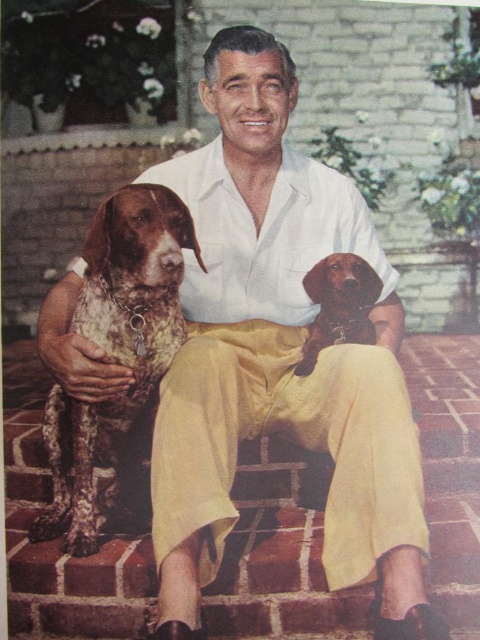
Question: Which point is closer to the camera taking this photo?

Choices:
 (A) (339, 300)
 (B) (56, 465)

Answer: (A)

Question: Does speckled fur dog at left appear over smooth brown dachshund at center?

Choices:
 (A) no
 (B) yes

Answer: (A)

Question: Which of the following is the farthest from the observer?

Choices:
 (A) (78, 552)
 (B) (348, 305)

Answer: (B)

Question: Which of the following is the farthest from the observer?

Choices:
 (A) speckled fur dog at left
 (B) smooth brown dachshund at center

Answer: (B)

Question: Does speckled fur dog at left appear over smooth brown dachshund at center?

Choices:
 (A) yes
 (B) no

Answer: (B)

Question: Can you confirm if speckled fur dog at left is positioned to the left of smooth brown dachshund at center?

Choices:
 (A) yes
 (B) no

Answer: (A)